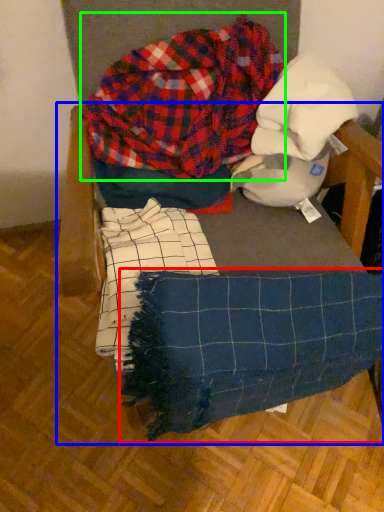
Question: Which is farther away from blanket (highlighted by a red box)? furniture (highlighted by a blue box) or flannel (highlighted by a green box)?

Choices:
 (A) furniture
 (B) flannel

Answer: (B)